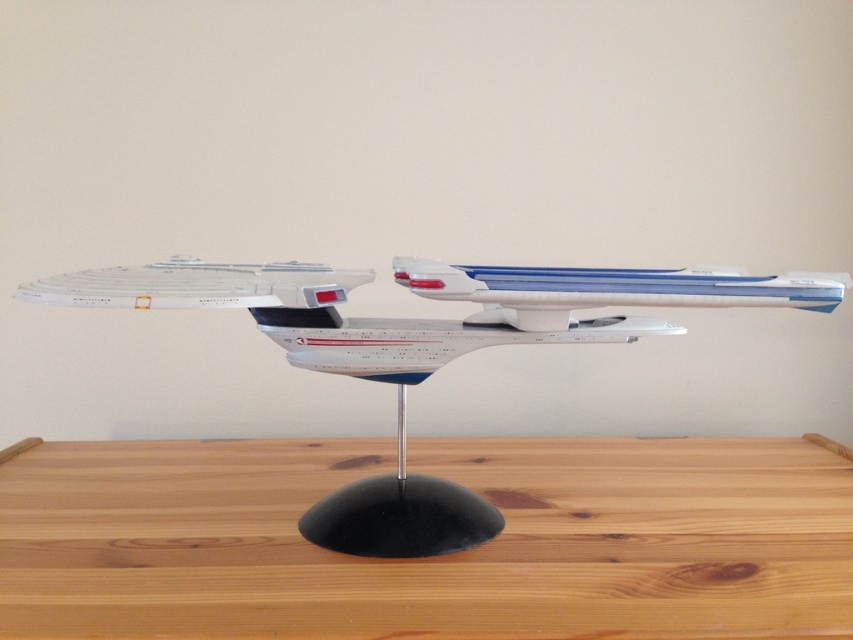
You are an astronaut preparing for a mission and see both the white plastic starship at center and the white plastic airplane at center on your desk. Which object is closer to you?

The white plastic airplane at center is closer to you because the white plastic starship at center is positioned under it, meaning the airplane is above and thus nearer.

You are trying to place a white plastic airplane at center on a light brown wood table at center. Can the airplane fit entirely on the table without hanging over the edges?

The light brown wood table at center might be wider than white plastic airplane at center, so there is a possibility that the airplane can fit, but it is uncertain without exact measurements.

You are an astronaut who just landed on a distant planet and found a model of a spacecraft. You need to place a souvenir on the light brown wood table at center so that it doesn not block the view of the white plastic airplane at center. Where should you place the souvenir?

The light brown wood table at center is in front of the white plastic airplane at center, so placing the souvenir on the table would block the view of the airplane. To avoid blocking the view, place the souvenir behind the table, closer to the white plastic airplane at center.